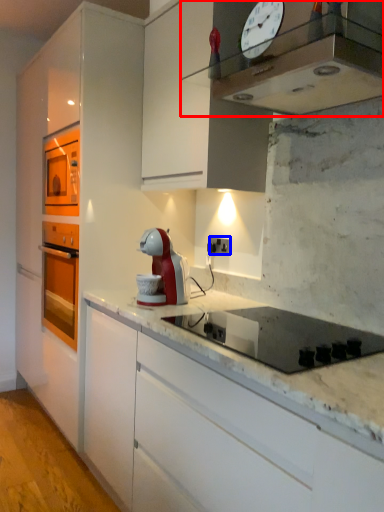
Question: Which object appears closest to the camera in this image, home appliance (highlighted by a red box) or electric outlet (highlighted by a blue box)?

Choices:
 (A) home appliance
 (B) electric outlet

Answer: (A)